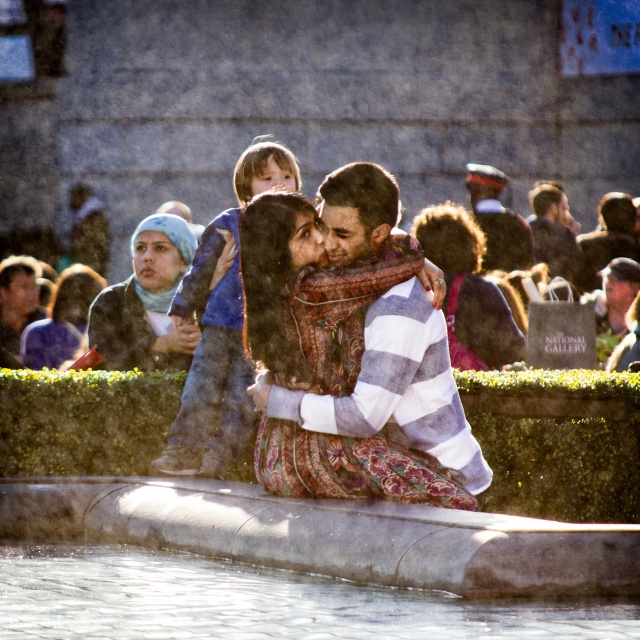
Is blue fabric headscarf at upper left smaller than matte blue scarf at upper left?

No.

Is blue fabric headscarf at upper left thinner than matte blue scarf at upper left?

No.

Who is more distant from viewer, (132, 352) or (65, 349)?

Positioned behind is point (65, 349).

The image size is (640, 640). Find the location of `blue fabric headscarf at upper left`. blue fabric headscarf at upper left is located at coordinates (147, 301).

Does clear water at lower center have a larger size compared to blue denim jeans at center?

No, clear water at lower center is not bigger than blue denim jeans at center.

Which is in front, point (224, 611) or point (230, 250)?

Point (224, 611) is more forward.

Which is behind, point (141, 621) or point (212, 288)?

Positioned behind is point (212, 288).

Locate an element on the screen. The height and width of the screenshot is (640, 640). clear water at lower center is located at coordinates (257, 602).

Looking at this image, can you confirm if striped cotton sweater at center is taller than matte blue scarf at upper left?

Yes, striped cotton sweater at center is taller than matte blue scarf at upper left.

Where is `striped cotton sweater at center`? Image resolution: width=640 pixels, height=640 pixels. striped cotton sweater at center is located at coordinates pyautogui.click(x=364, y=368).

Where is `striped cotton sweater at center`? striped cotton sweater at center is located at coordinates 364,368.

The height and width of the screenshot is (640, 640). I want to click on striped cotton sweater at center, so click(x=364, y=368).